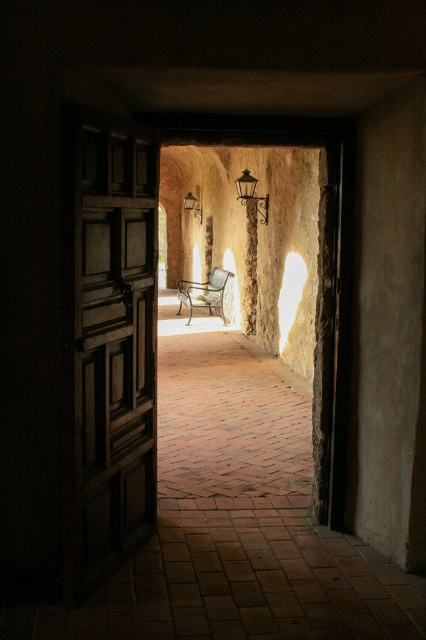
From the picture: You are standing in front of the open wooden door and want to hang a decorative item on the taller object between the smooth stone pillar at center and the matte black lamp at center. Which object should you choose?

The smooth stone pillar at center has a greater height compared to the matte black lamp at center, so you should choose the smooth stone pillar at center to hang the decorative item.

You are standing in front of the open wooden door and want to place a smooth stone pillar exactly at point (250, 268). According to the scene description, is there already an object at that location?

Yes, there is already a smooth stone pillar at center located at point (250, 268).

You are standing in a hallway and want to place a 1.5 meter long sofa between the wooden panelled door at left and the matte black lamp at center. Is there enough space?

The wooden panelled door at left is 12.07 meters away from the matte black lamp at center, so yes, the sofa will fit comfortably between them as the distance is much greater than the sofa length.